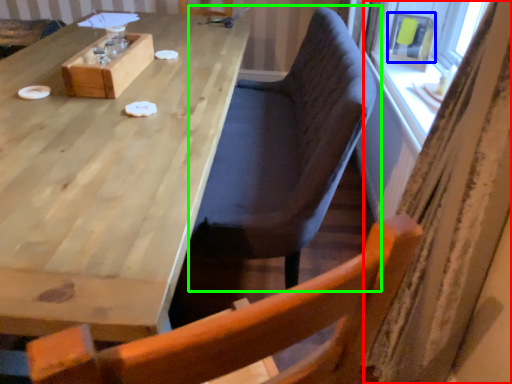
Question: Based on their relative distances, which object is nearer to curtain (highlighted by a red box)? Choose from window screen (highlighted by a blue box) and chair (highlighted by a green box).

Choices:
 (A) window screen
 (B) chair

Answer: (B)